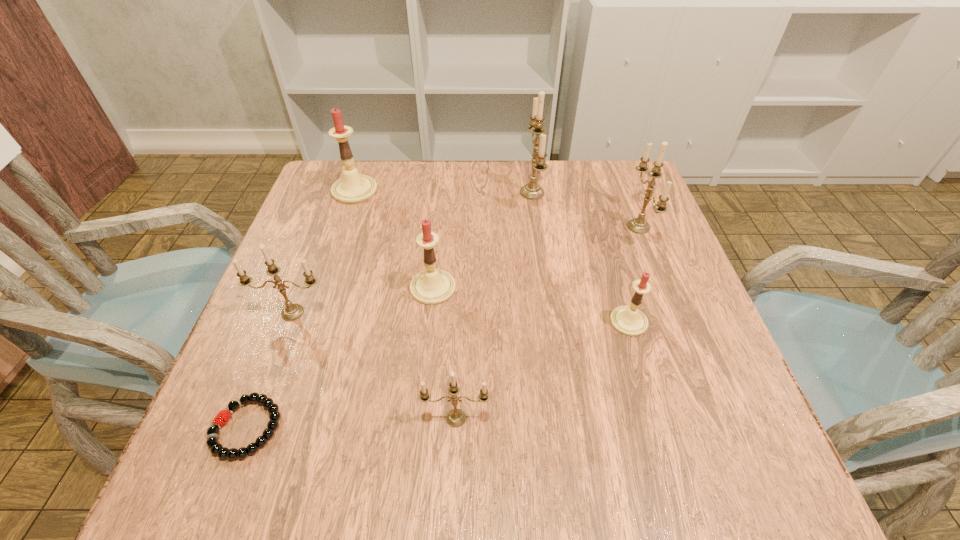
Locate an element on the screen. red candle that is the second closest one to the second biggest red candle is located at coordinates (629, 320).

Choose which red candle is the second nearest neighbor to the bracelet. Please provide its 2D coordinates. Your answer should be formatted as a tuple, i.e. [(x, y)], where the tuple contains the x and y coordinates of a point satisfying the conditions above.

[(353, 188)]

Find the location of a particular element. This screenshot has height=540, width=960. free location that satisfies the following two spatial constraints: 1. on the front side of the leftmost red candle; 2. on the right side of the second red candle from right to left is located at coordinates (322, 288).